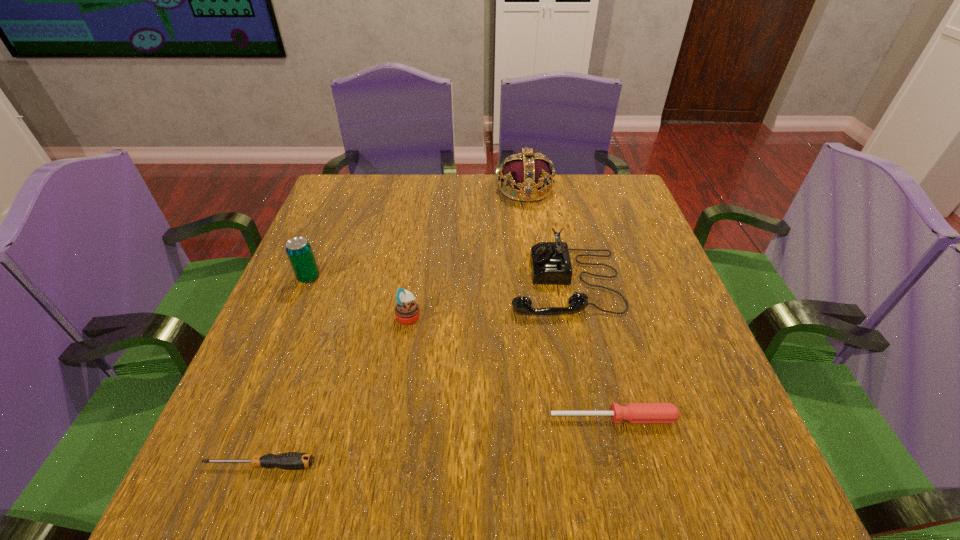
The width and height of the screenshot is (960, 540). I want to click on empty location between the left screwdriver and the crown, so click(x=393, y=327).

You are a GUI agent. You are given a task and a screenshot of the screen. Output one action in this format:
    pyautogui.click(x=<x>, y=<y>)
    Task: Click on the empty space that is in between the nearest object and the third shortest object
    Image resolution: width=960 pixels, height=540 pixels.
    Given the screenshot: What is the action you would take?
    pyautogui.click(x=334, y=391)

Find the location of a particular element. The height and width of the screenshot is (540, 960). free spot between the farthest object and the left screwdriver is located at coordinates (393, 327).

This screenshot has width=960, height=540. I want to click on free spot between the beer can and the crown, so click(417, 233).

I want to click on vacant space that is in between the nearer screwdriver and the second nearest object, so click(437, 441).

This screenshot has height=540, width=960. In order to click on vacant area between the fourth object from right to left and the telephone in this screenshot , I will do `click(487, 299)`.

You are a GUI agent. You are given a task and a screenshot of the screen. Output one action in this format:
    pyautogui.click(x=<x>, y=<y>)
    Task: Click on the vacant area that lies between the crown and the fourth tallest object
    This screenshot has height=540, width=960.
    Given the screenshot: What is the action you would take?
    pyautogui.click(x=467, y=253)

Locate an element on the screen. unoccupied area between the left screwdriver and the crown is located at coordinates (393, 327).

The width and height of the screenshot is (960, 540). What are the coordinates of `free space between the farther screwdriver and the beer can` in the screenshot? It's located at (461, 348).

Locate an element on the screen. Image resolution: width=960 pixels, height=540 pixels. object that is the third closest to the farther screwdriver is located at coordinates (291, 460).